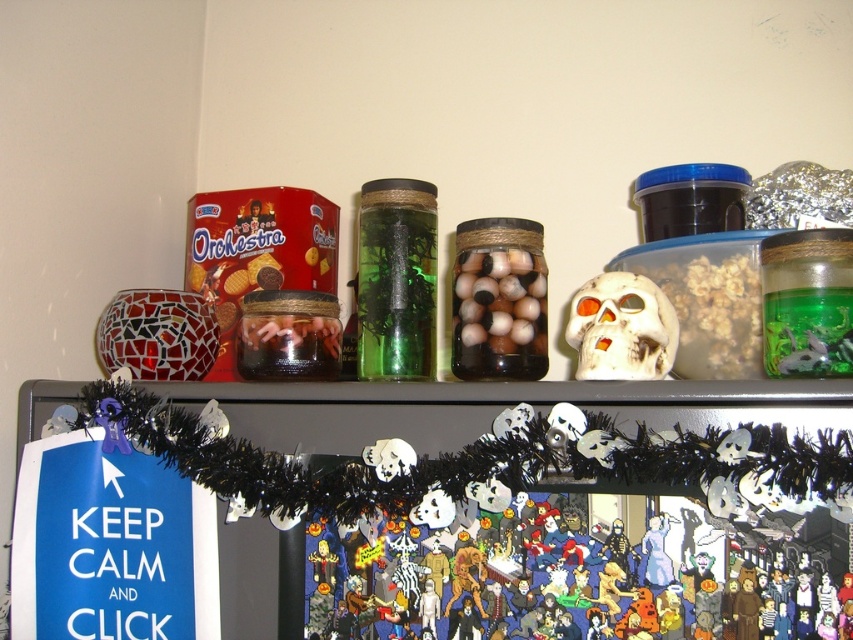
You are organizing the items on the fridge shelf and need to place a new item between the translucent glass jar filled with marbles at center and the translucent glass jar at center. Which jar should you place the new item closer to, based on their positions?

The translucent glass jar filled with marbles at center is closer to the viewer than the translucent glass jar at center. Therefore, you should place the new item closer to the translucent glass jar at center since it is farther back.

You are standing in front of the refrigerator shelf and notice two points marked on the shelf. The first point is at coordinates point (x=357, y=368) and the second is at point (x=590, y=340). From your perspective, which point is closer to you?

Point (x=590, y=340) is closer to you because point (x=357, y=368) is behind it.

You are looking at the refrigerator shelf and need to place a new item exactly at the center of the shelf. Is the transparent glass jar at center already occupying that spot?

The transparent glass jar at center is located at the 2D coordinates point (396, 280), so yes, it is already occupying the center of the shelf.